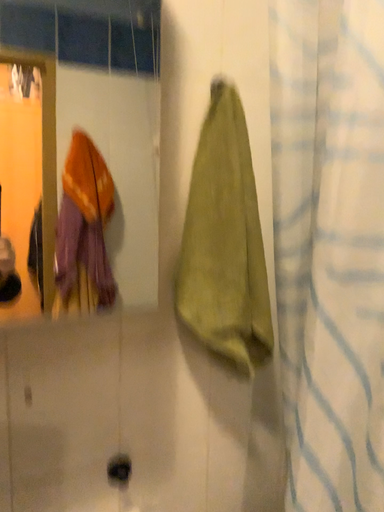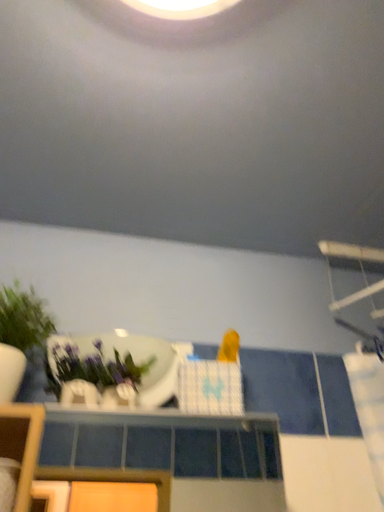
Question: How did the camera likely rotate when shooting the video?

Choices:
 (A) rotated downward
 (B) rotated upward

Answer: (B)